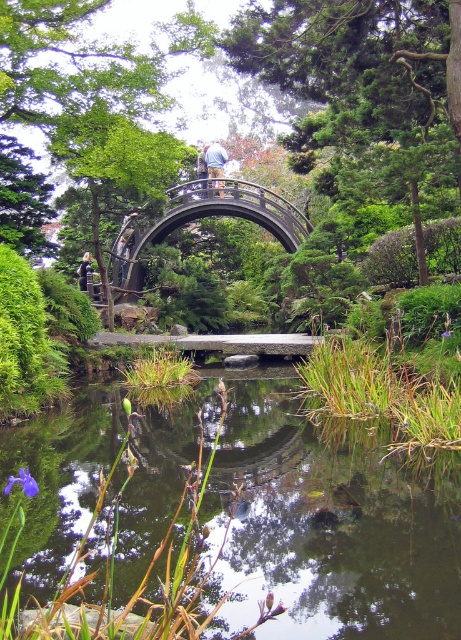
Question: Does green grassy water at center appear on the left side of dark brown wooden bridge at center?

Choices:
 (A) yes
 (B) no

Answer: (B)

Question: Which of the following is the closest to the observer?

Choices:
 (A) (247, 540)
 (B) (135, 260)

Answer: (A)

Question: Does green grassy water at center lie behind dark brown wooden bridge at center?

Choices:
 (A) no
 (B) yes

Answer: (A)

Question: Considering the relative positions of green grassy water at center and dark brown wooden bridge at center in the image provided, where is green grassy water at center located with respect to dark brown wooden bridge at center?

Choices:
 (A) above
 (B) below

Answer: (B)

Question: Which object is closer to the camera taking this photo?

Choices:
 (A) green grassy water at center
 (B) dark brown wooden bridge at center

Answer: (A)